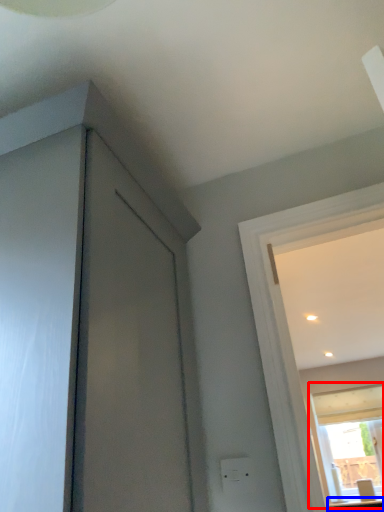
Question: Which of the following is the closest to the observer, window (highlighted by a red box) or counter top (highlighted by a blue box)?

Choices:
 (A) window
 (B) counter top

Answer: (B)